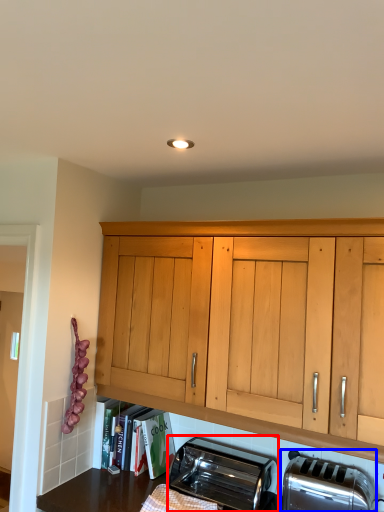
Question: Which object appears closest to the camera in this image, toaster (highlighted by a red box) or toaster (highlighted by a blue box)?

Choices:
 (A) toaster
 (B) toaster

Answer: (B)